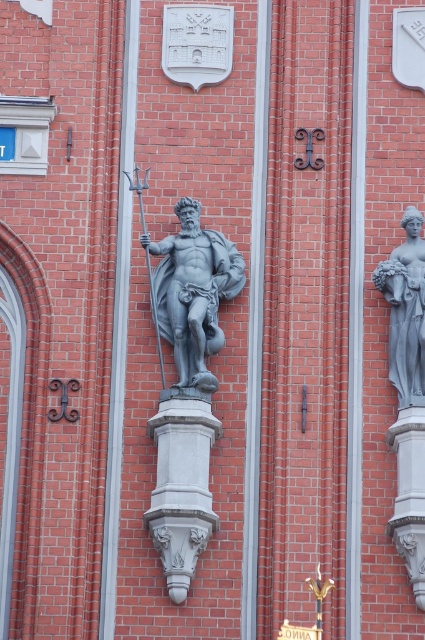
Question: Does polished gray statue at center have a smaller size compared to matte gray statue at right?

Choices:
 (A) no
 (B) yes

Answer: (B)

Question: Is polished gray statue at center wider than gray stone pedestal at center?

Choices:
 (A) yes
 (B) no

Answer: (B)

Question: Which of the following is the closest to the observer?

Choices:
 (A) gray stone pedestal at center
 (B) polished gray statue at center

Answer: (A)

Question: Which of the following is the farthest from the observer?

Choices:
 (A) (422, 280)
 (B) (181, 444)
 (C) (303, 634)

Answer: (A)

Question: Can you confirm if gray stone pedestal at center is thinner than matte gray statue at right?

Choices:
 (A) no
 (B) yes

Answer: (A)

Question: Which object is closer to the camera taking this photo?

Choices:
 (A) gold metallic plaque at center bottom
 (B) polished gray statue at center
 (C) smooth gray stone at center

Answer: (A)